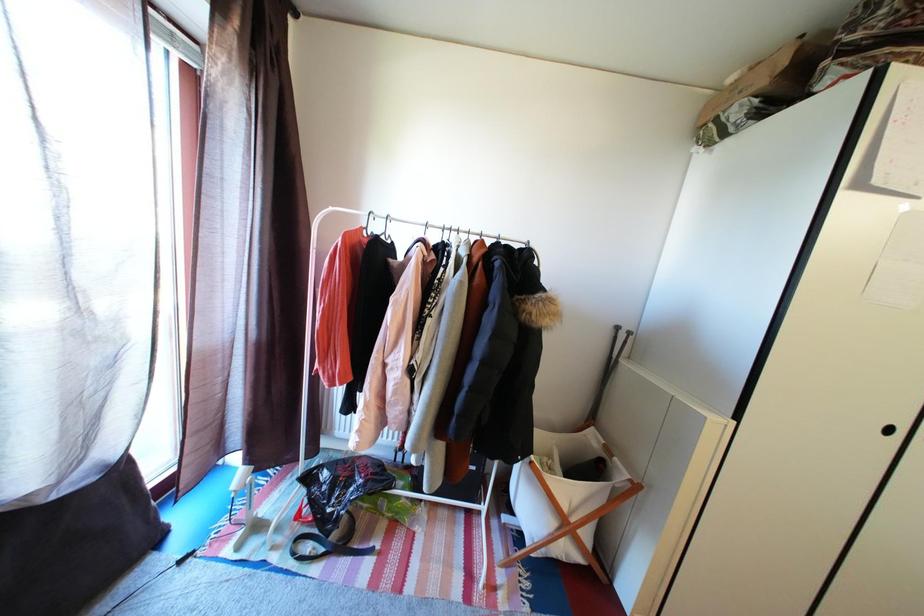
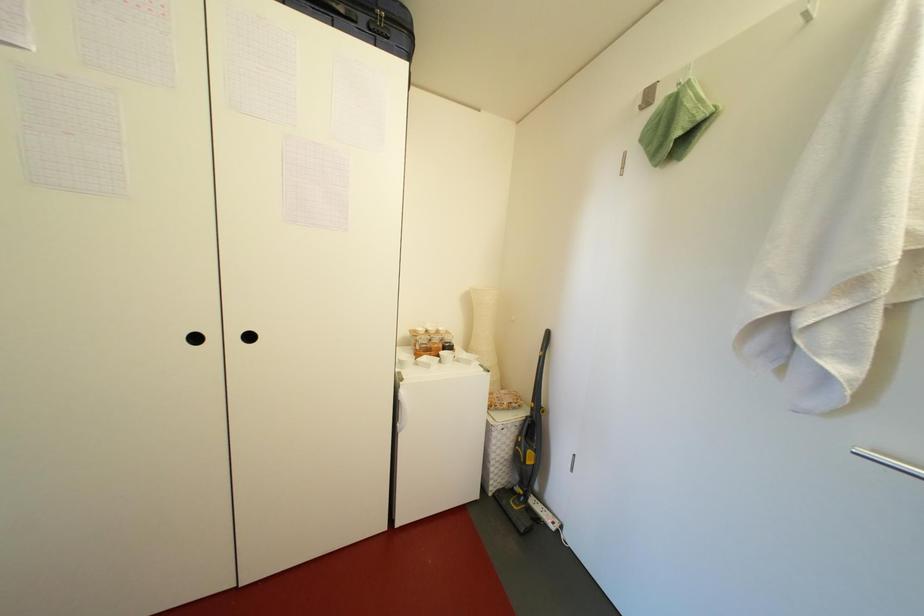
Question: In a continuous first-person perspective shot, in which direction is the camera moving?

Choices:
 (A) Left
 (B) Right
 (C) Forward
 (D) Backward

Answer: (B)